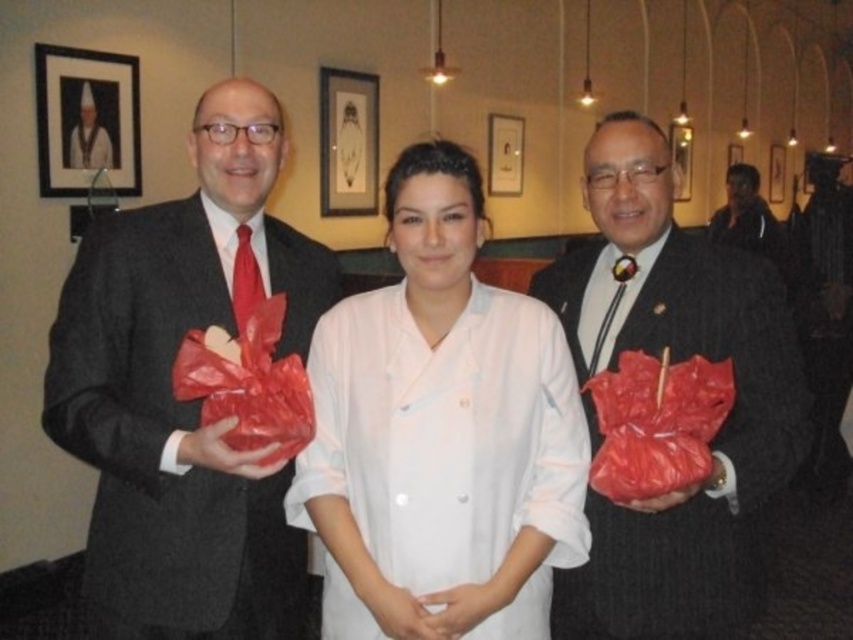
Based on the scene description, where is the matte black suit at left positioned in terms of its 2D coordinates?

The matte black suit at left is positioned at the 2D coordinates of point (x=184, y=401).

You are a photographer at this event and need to arrange the two people in the image so that the white smooth uniform at center is to the right of the matte black suit at right. Is their current arrangement correct?

The white smooth uniform at center is currently positioned on the left side of the matte black suit at right, so their current arrangement is incorrect. To meet your requirement, you should swap their positions so that the white smooth uniform at center is on the right side of the matte black suit at right.

You are a photographer positioned at the front of the room. You need to take a photo of both the matte black suit at left and the black fabric jacket at upper right. Which one will appear larger in the photo?

The matte black suit at left will appear larger in the photo because it is closer to the viewer than the black fabric jacket at upper right.